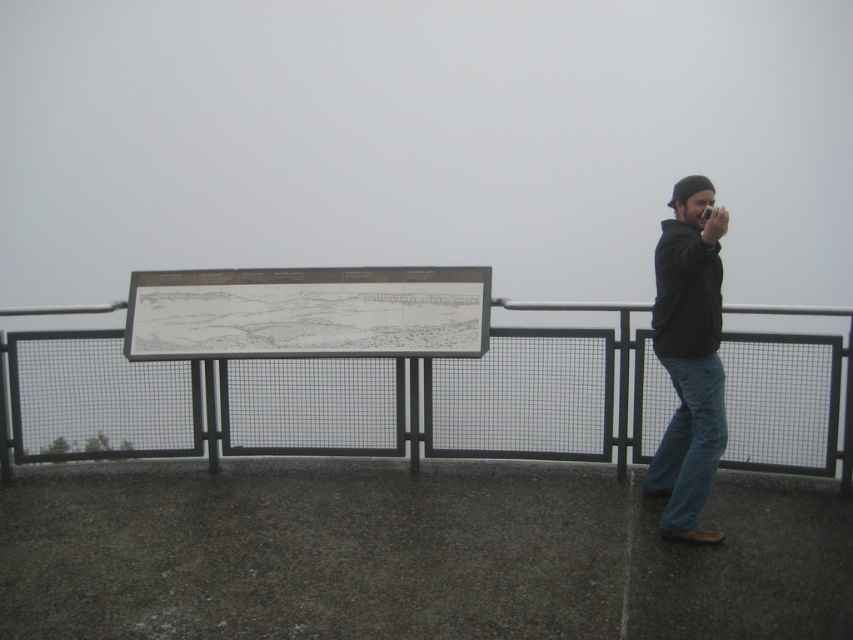
Question: Which of the following is the closest to the observer?

Choices:
 (A) (666, 512)
 (B) (689, 349)

Answer: (B)

Question: Can you confirm if black matte jacket at right is positioned below denim at right?

Choices:
 (A) no
 (B) yes

Answer: (A)

Question: Does black matte jacket at right have a greater width compared to denim at right?

Choices:
 (A) no
 (B) yes

Answer: (B)

Question: Does metal mesh fence at center appear on the right side of denim at right?

Choices:
 (A) yes
 (B) no

Answer: (B)

Question: Which is nearer to the denim at right?

Choices:
 (A) black matte jacket at right
 (B) metal mesh fence at center

Answer: (A)

Question: Considering the real-world distances, which object is closest to the metal mesh fence at center?

Choices:
 (A) black matte jacket at right
 (B) denim at right

Answer: (A)